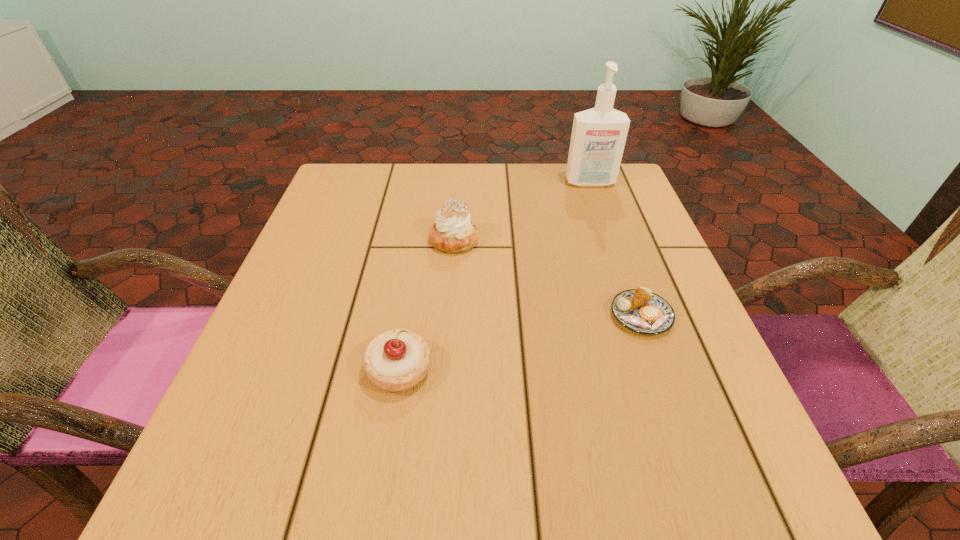
You are a GUI agent. You are given a task and a screenshot of the screen. Output one action in this format:
    pyautogui.click(x=<x>, y=<y>)
    Task: Click on the empty space that is in between the nearest object and the second tallest object
    The height and width of the screenshot is (540, 960).
    Given the screenshot: What is the action you would take?
    pyautogui.click(x=427, y=305)

This screenshot has height=540, width=960. Identify the location of vacant point located between the farthest pastry and the cleansing agent. tap(522, 212).

At what (x,y) coordinates should I click in order to perform the action: click on vacant region between the rightmost pastry and the tallest object. Please return your answer as a coordinate pair (x, y). Looking at the image, I should click on (615, 249).

I want to click on vacant space that's between the second tallest object and the tallest object, so click(x=522, y=212).

Identify which object is the third closest to the cleansing agent. Please provide its 2D coordinates. Your answer should be formatted as a tuple, i.e. [(x, y)], where the tuple contains the x and y coordinates of a point satisfying the conditions above.

[(396, 360)]

Identify which object is located as the nearest to the second nearest object. Please provide its 2D coordinates. Your answer should be formatted as a tuple, i.e. [(x, y)], where the tuple contains the x and y coordinates of a point satisfying the conditions above.

[(452, 232)]

Select which pastry appears as the closest to the nearest pastry. Please provide its 2D coordinates. Your answer should be formatted as a tuple, i.e. [(x, y)], where the tuple contains the x and y coordinates of a point satisfying the conditions above.

[(452, 232)]

Choose which pastry is the second nearest neighbor to the third tallest object. Please provide its 2D coordinates. Your answer should be formatted as a tuple, i.e. [(x, y)], where the tuple contains the x and y coordinates of a point satisfying the conditions above.

[(640, 310)]

Locate an element on the screen. Image resolution: width=960 pixels, height=540 pixels. free location that satisfies the following two spatial constraints: 1. on the front side of the shortest object; 2. on the left side of the third nearest object is located at coordinates (449, 316).

Locate an element on the screen. The width and height of the screenshot is (960, 540). free space that satisfies the following two spatial constraints: 1. on the back side of the second tallest object; 2. on the left side of the nearest object is located at coordinates (420, 240).